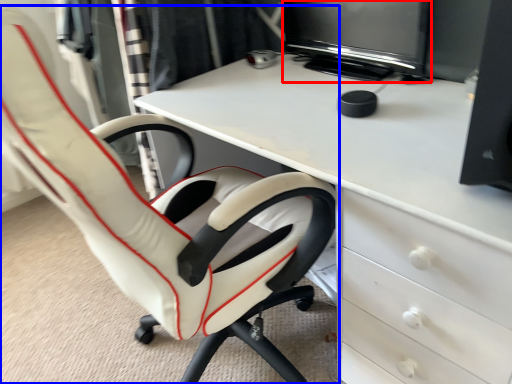
Question: Which object is closer to the camera taking this photo, computer monitor (highlighted by a red box) or chair (highlighted by a blue box)?

Choices:
 (A) computer monitor
 (B) chair

Answer: (B)